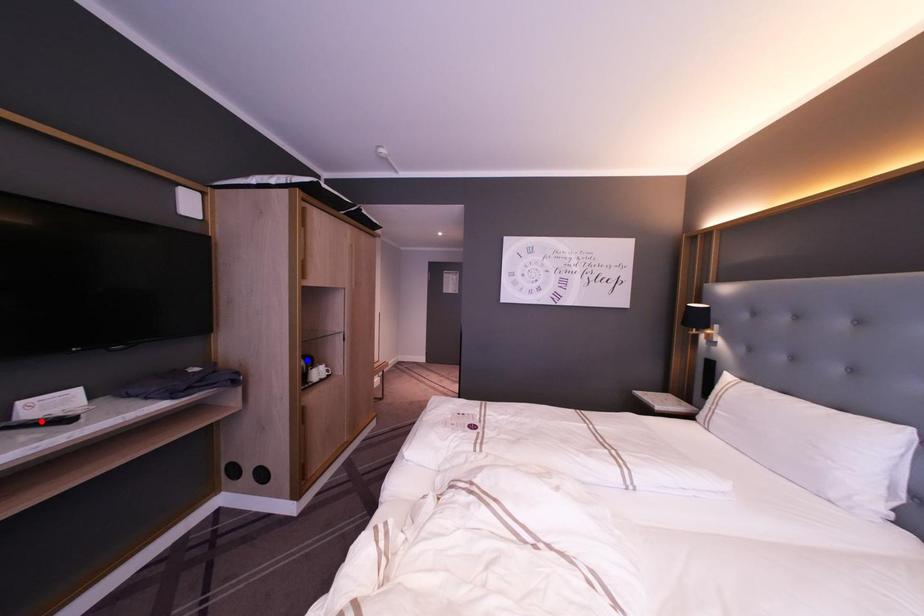
Question: Which of the two points in the image is closer to the camera?

Choices:
 (A) Blue point is closer.
 (B) Red point is closer.

Answer: (B)